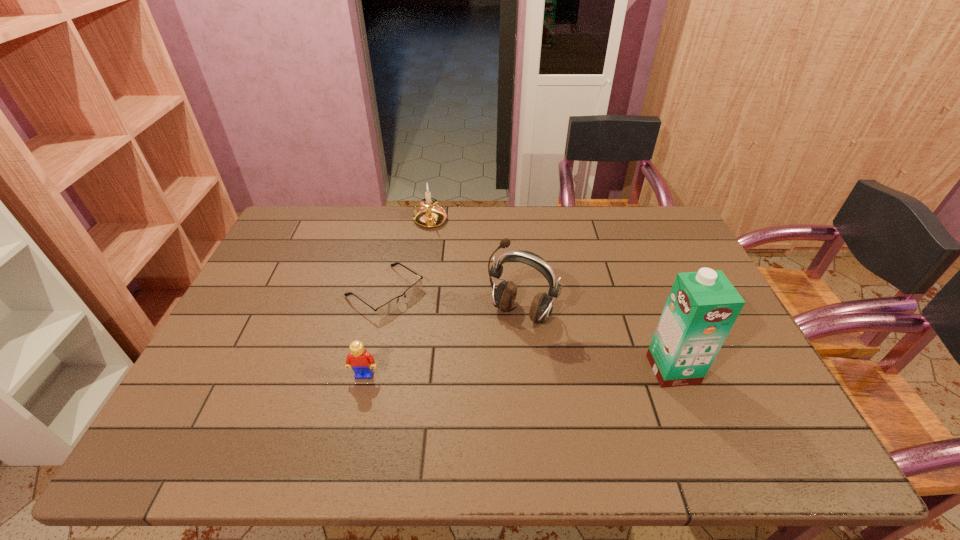
This screenshot has height=540, width=960. In order to click on vacant space that is in between the third tallest object and the shortest object in this screenshot , I will do `click(407, 256)`.

Locate an element on the screen. vacant region between the shortest object and the second shortest object is located at coordinates (374, 333).

You are a GUI agent. You are given a task and a screenshot of the screen. Output one action in this format:
    pyautogui.click(x=<x>, y=<y>)
    Task: Click on the free area in between the carton and the Lego
    
    Given the screenshot: What is the action you would take?
    pyautogui.click(x=518, y=372)

The width and height of the screenshot is (960, 540). Identify the location of vacant space in between the third shortest object and the earphone. (475, 267).

Identify the location of free spot between the Lego and the fourth shortest object. (443, 344).

What are the coordinates of `blank region between the spectacles and the fourth tallest object` in the screenshot? It's located at (374, 333).

Find the location of a particular element. empty location between the spectacles and the fourth object from left to right is located at coordinates (453, 302).

Locate an element on the screen. The image size is (960, 540). object that can be found as the second closest to the Lego is located at coordinates (504, 296).

Locate which object is the closest to the rightmost object. Please provide its 2D coordinates. Your answer should be formatted as a tuple, i.e. [(x, y)], where the tuple contains the x and y coordinates of a point satisfying the conditions above.

[(504, 296)]